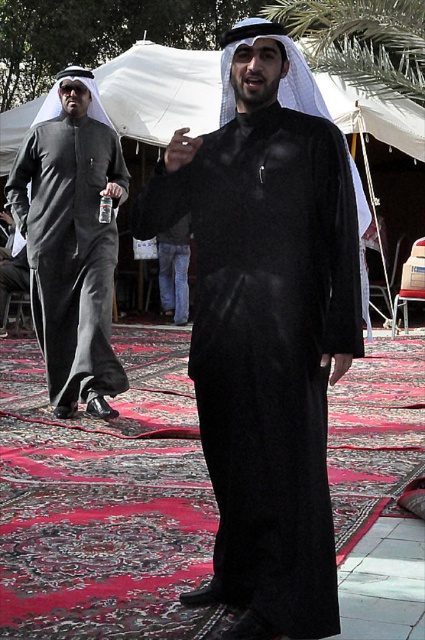
You are organizing a cultural event and need to arrange seating for two individuals wearing traditional attire. The first person is wearing a black matte robe at center, and the second is wearing a matte black robe at left. Based on their attire, which person requires more space for seating?

The matte black robe at left requires more space for seating because it occupies more space than the black matte robe at center.

In the scene shown: You are a photographer who needs to capture a clear photo of both individuals in the scene. Since the black matte robe at center and the matte black robe at left are positioned close to each other, which one should you focus on first to ensure the foreground subject is sharp?

The black matte robe at center should be focused on first because it is in front of the matte black robe at left, making it the foreground subject.

You are standing in front of the two individuals on the patterned red carpet. You need to determine which of the two points, point (235, 602) or point (95, 214), is closer to you. Which one is it?

Point (235, 602) is closer to the viewer than point (95, 214).